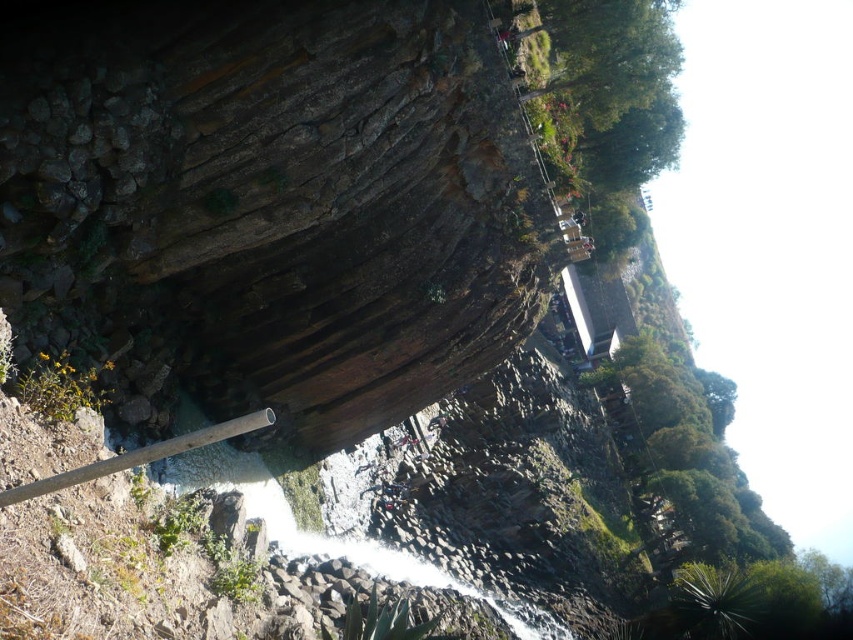
Can you confirm if brown rough rock at center is bigger than white frothy water at center?

Yes, brown rough rock at center is bigger than white frothy water at center.

Can you confirm if brown rough rock at center is shorter than white frothy water at center?

No, brown rough rock at center is not shorter than white frothy water at center.

Who is more forward, (206, 88) or (357, 464)?

Positioned in front is point (206, 88).

The image size is (853, 640). I want to click on brown rough rock at center, so click(286, 192).